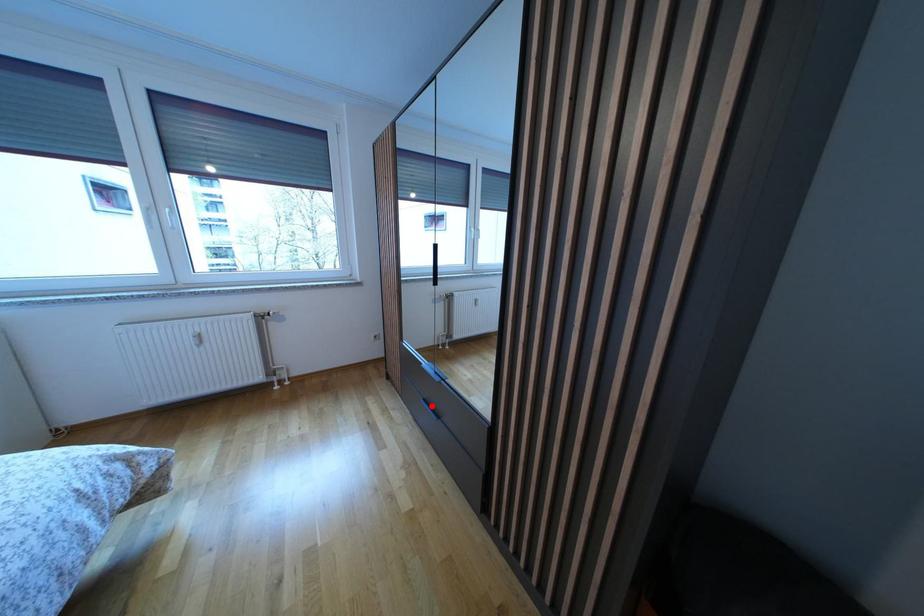
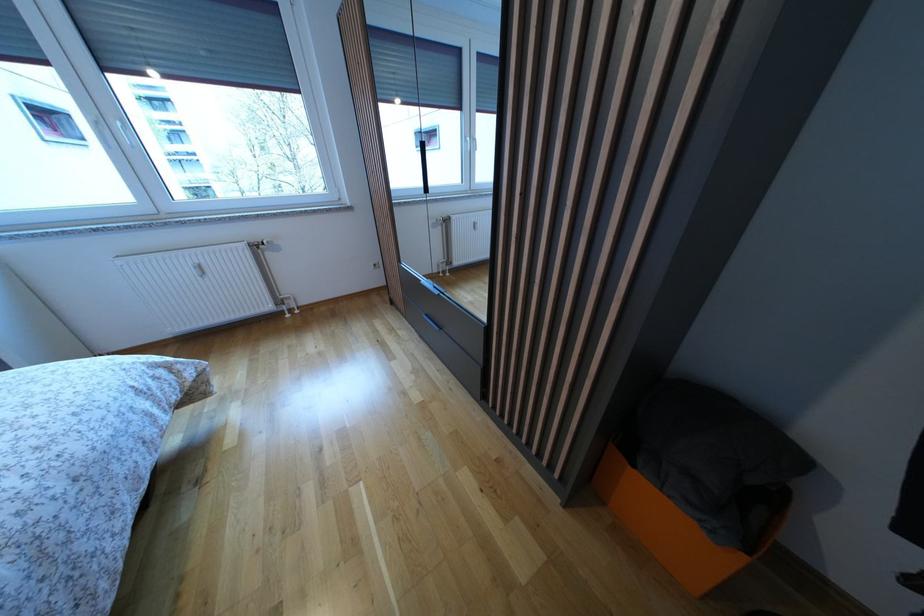
Locate, in the second image, the point that corresponds to the highlighted location in the first image.

(433, 321)